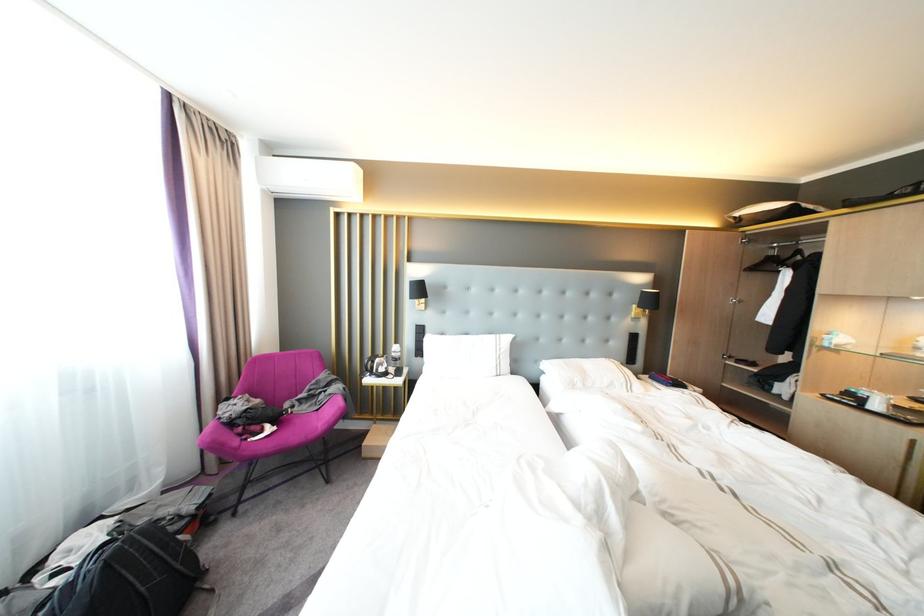
Describe the element at coordinates (129, 578) in the screenshot. The height and width of the screenshot is (616, 924). I see `the black backpack` at that location.